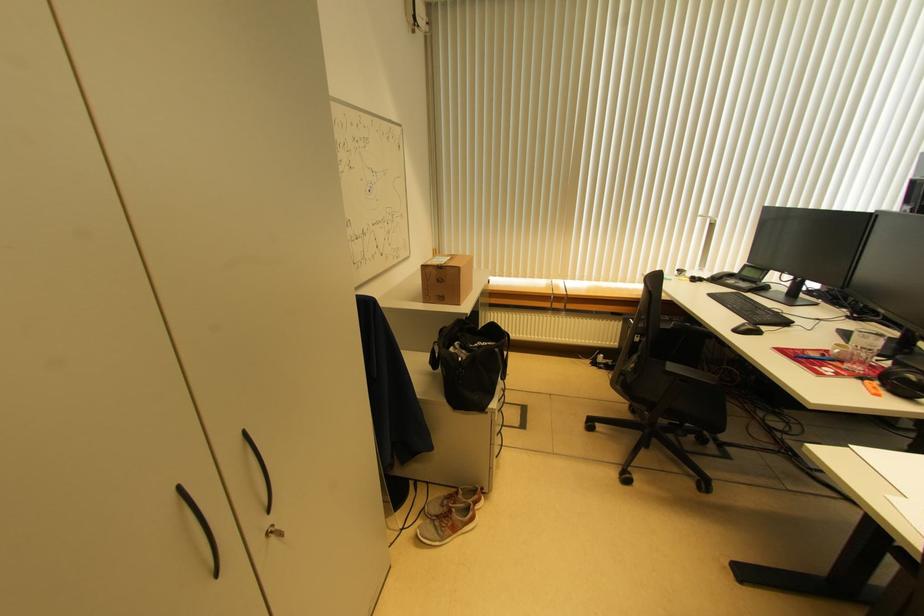
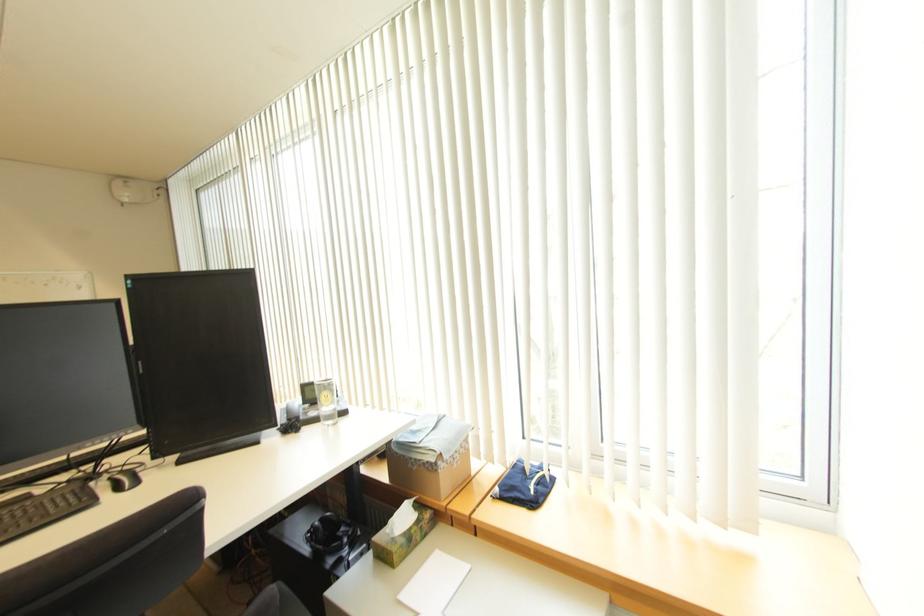
Question: In a continuous first-person perspective shot, in which direction is the camera moving?

Choices:
 (A) Left
 (B) Right
 (C) Forward
 (D) Backward

Answer: (B)